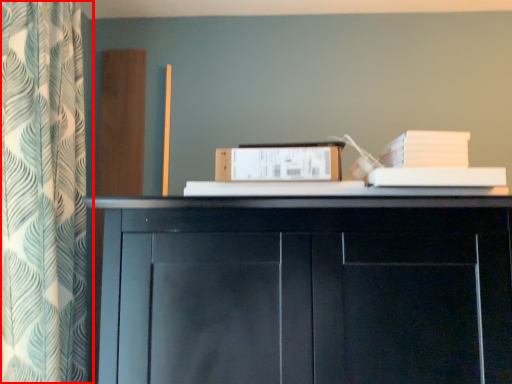
Question: From the image's perspective, considering the relative positions of curtain (annotated by the red box) and paperback book in the image provided, where is curtain (annotated by the red box) located with respect to the staircase?

Choices:
 (A) above
 (B) below

Answer: (A)